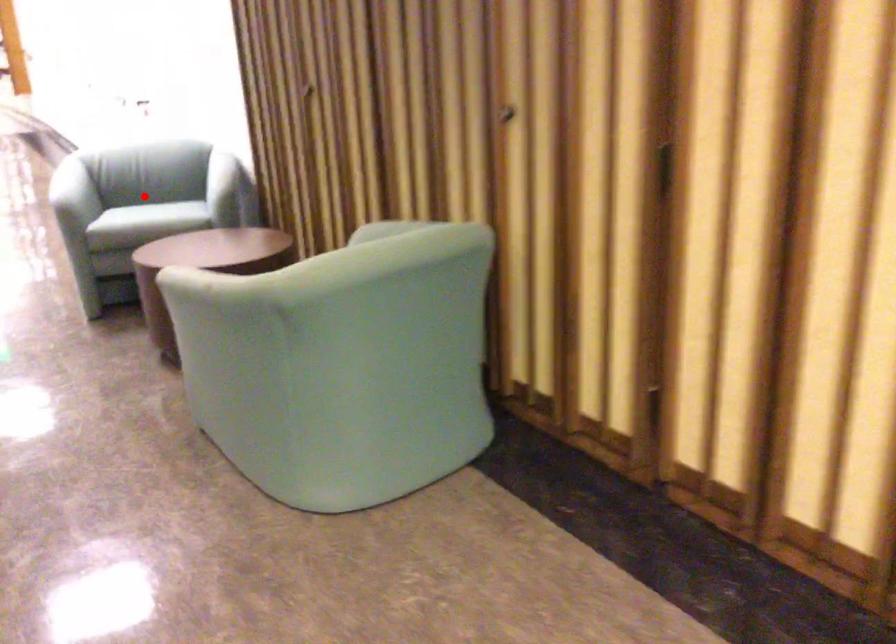
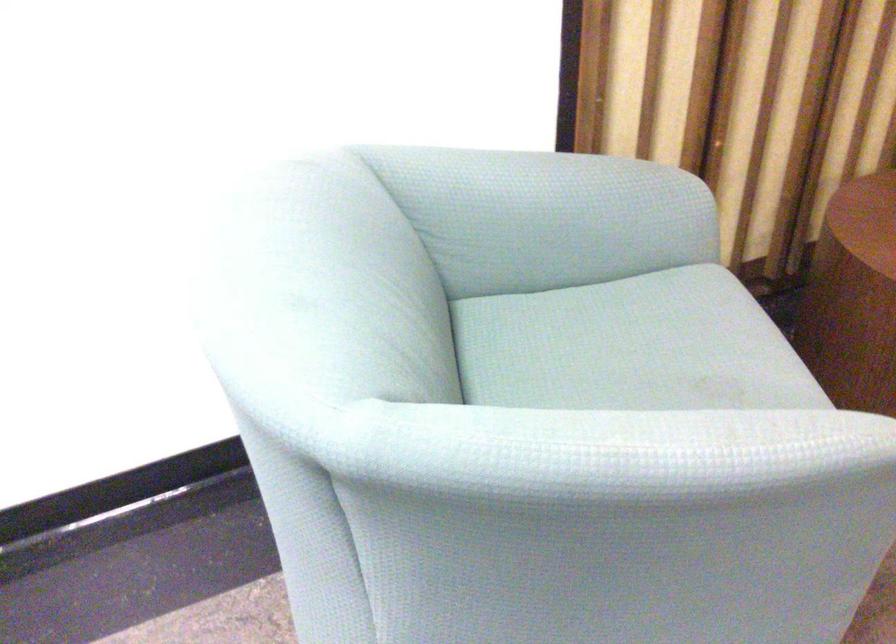
Question: I am providing you with two images of the same scene from different viewpoints. Given a red point in image1, look at the same physical point in image2. Is it:

Choices:
 (A) Closer to the viewpoint
 (B) Farther from the viewpoint

Answer: (A)